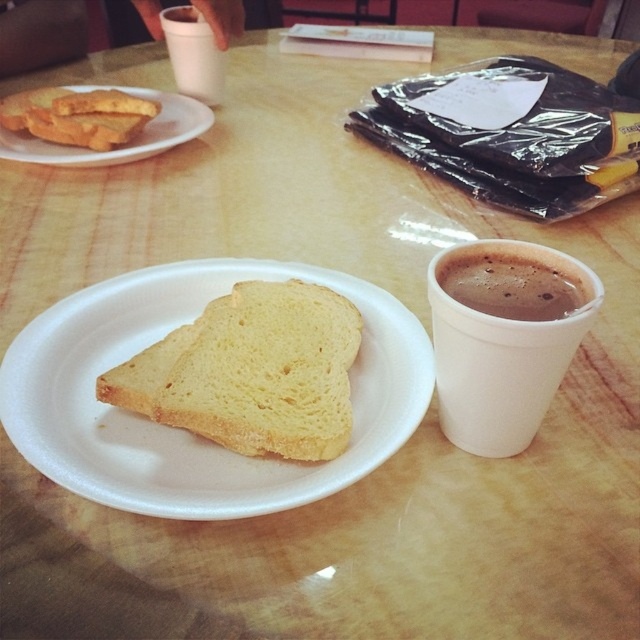
Who is shorter, white styrofoam cup at right or brown matte cup of coffee at right?

brown matte cup of coffee at right

Can you confirm if white styrofoam cup at right is positioned to the right of brown matte cup of coffee at right?

Incorrect, white styrofoam cup at right is not on the right side of brown matte cup of coffee at right.

Which is behind, point (435, 356) or point (554, 269)?

The point (435, 356) is behind.

Where is `white styrofoam cup at right`? white styrofoam cup at right is located at coordinates (500, 355).

What do you see at coordinates (512, 284) in the screenshot?
I see `brown matte cup of coffee at right` at bounding box center [512, 284].

Which is above, brown matte cup of coffee at right or white paper plate at upper left?

Positioned higher is white paper plate at upper left.

Does point (524, 269) come farther from viewer compared to point (74, 157)?

No.

You are a GUI agent. You are given a task and a screenshot of the screen. Output one action in this format:
    pyautogui.click(x=<x>, y=<y>)
    Task: Click on the brown matte cup of coffee at right
    The height and width of the screenshot is (640, 640).
    Given the screenshot: What is the action you would take?
    pyautogui.click(x=512, y=284)

Between white paper plate at center and white styrofoam cup at right, which one is positioned lower?

white paper plate at center is lower down.

Does white paper plate at center have a lesser width compared to white styrofoam cup at right?

No.

Identify the location of white paper plate at center. (246, 460).